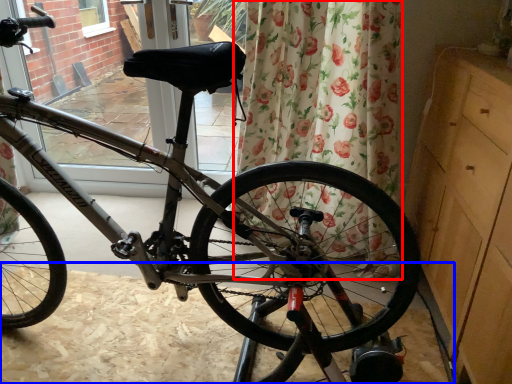
Question: Which of the following is the farthest to the observer, curtain (highlighted by a red box) or dirt track (highlighted by a blue box)?

Choices:
 (A) curtain
 (B) dirt track

Answer: (A)